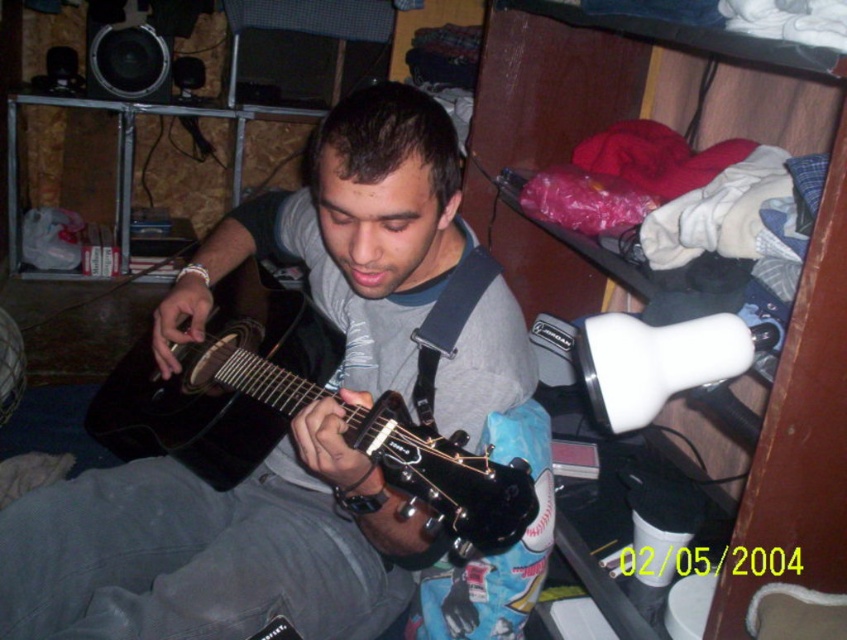
Question: Which point is closer to the camera taking this photo?

Choices:
 (A) (291, 419)
 (B) (663, 42)

Answer: (A)

Question: Which object is farther from the camera taking this photo?

Choices:
 (A) white plastic lamp at upper right
 (B) matte black guitar at center

Answer: (B)

Question: Based on their relative distances, which object is farther from the matte black guitar at center?

Choices:
 (A) white plastic lamp at upper right
 (B) matte black acoustic guitar at center

Answer: (A)

Question: Can you confirm if matte black guitar at center is positioned to the left of white plastic lamp at upper right?

Choices:
 (A) yes
 (B) no

Answer: (A)

Question: Can you confirm if white plastic lamp at upper right is smaller than matte black acoustic guitar at center?

Choices:
 (A) yes
 (B) no

Answer: (B)

Question: Can you confirm if matte black guitar at center is positioned to the right of white plastic lamp at upper right?

Choices:
 (A) no
 (B) yes

Answer: (A)